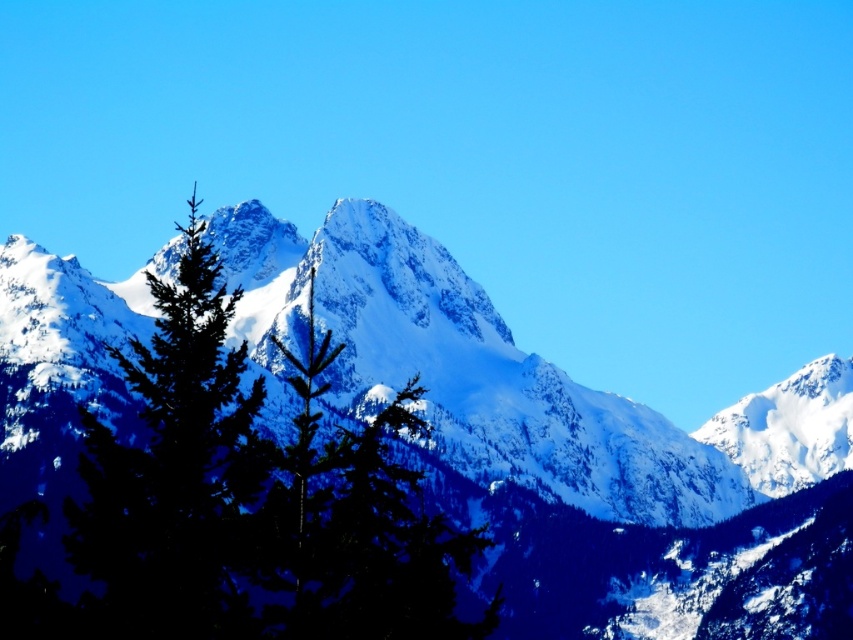
Question: Among these points, which one is farthest from the camera?

Choices:
 (A) (177, 371)
 (B) (142, 477)

Answer: (A)

Question: Is snowy peak at center in front of green matte tree at center?

Choices:
 (A) no
 (B) yes

Answer: (A)

Question: Is snowy peak at center above green matte tree at center?

Choices:
 (A) yes
 (B) no

Answer: (B)

Question: Which point appears farthest from the camera in this image?

Choices:
 (A) (331, 216)
 (B) (128, 556)

Answer: (A)

Question: Does snowy peak at center have a larger size compared to green matte tree at center?

Choices:
 (A) no
 (B) yes

Answer: (B)

Question: Which point is farther to the camera?

Choices:
 (A) (231, 499)
 (B) (395, 353)

Answer: (B)